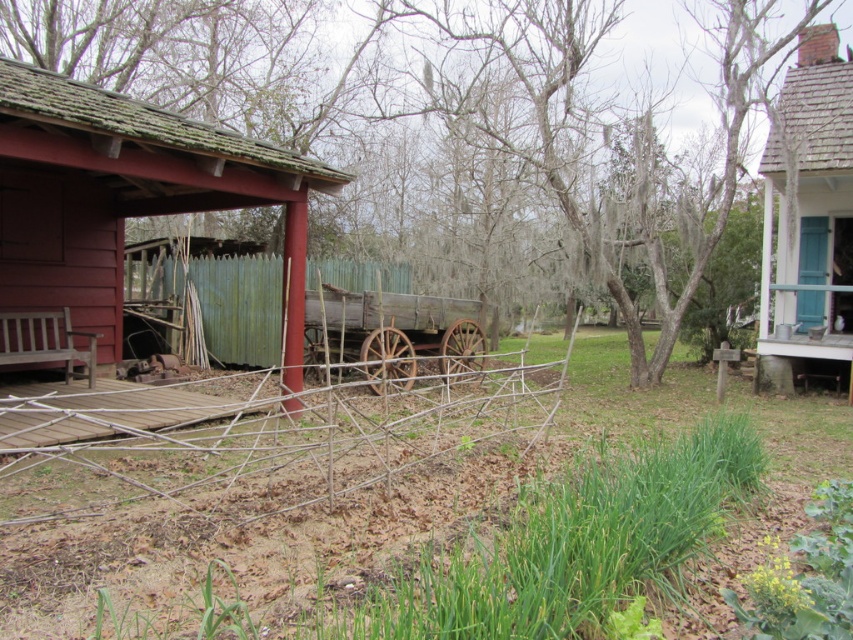
You are planning to build a new garden bed and need to know the relative sizes of the structures in the image. Which object is bigger between the wooden fence at center and the wooden cabin at upper right?

The wooden fence at center is larger in size than the wooden cabin at upper right.

You are standing in the garden and want to move towards the wooden cabin at upper right. Which direction should you move relative to the wooden fence at center?

You should move upwards from the wooden fence at center to reach the wooden cabin at upper right since the wooden cabin at upper right is above the wooden fence at center.